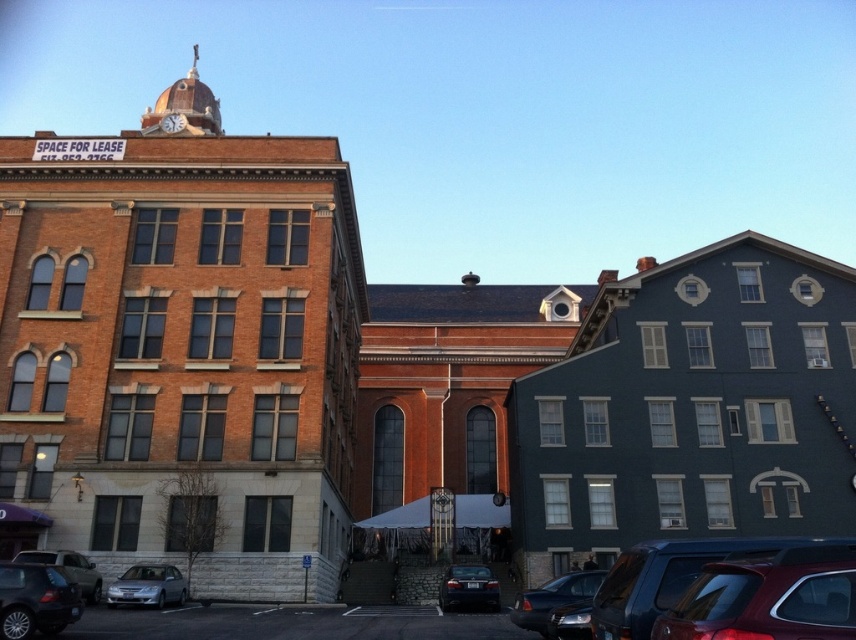
Can you confirm if shiny red car at lower right is wider than shiny black sedan at lower right?

In fact, shiny red car at lower right might be narrower than shiny black sedan at lower right.

Can you confirm if shiny red car at lower right is taller than shiny black sedan at lower right?

Incorrect, shiny red car at lower right's height is not larger of shiny black sedan at lower right's.

Which is behind, point (819, 630) or point (535, 605)?

The point (535, 605) is more distant.

You are a GUI agent. You are given a task and a screenshot of the screen. Output one action in this format:
    pyautogui.click(x=<x>, y=<y>)
    Task: Click on the shiny red car at lower right
    This screenshot has width=856, height=640.
    Given the screenshot: What is the action you would take?
    pyautogui.click(x=767, y=598)

Can you confirm if matte black car at lower left is positioned above satin silver sedan at lower left?

Yes.

Who is positioned more to the left, matte black car at lower left or satin silver sedan at lower left?

satin silver sedan at lower left is more to the left.

In the scene shown: Who is more forward, (37, 577) or (169, 579)?

Positioned in front is point (37, 577).

Locate an element on the screen. The image size is (856, 640). matte black car at lower left is located at coordinates (34, 600).

Between shiny black sedan at lower right and shiny black sedan at center, which one is positioned higher?

shiny black sedan at lower right is higher up.

Is point (521, 596) positioned in front of point (444, 604)?

Yes, point (521, 596) is closer to viewer.

In order to click on shiny black sedan at lower right in this screenshot , I will do `click(553, 598)`.